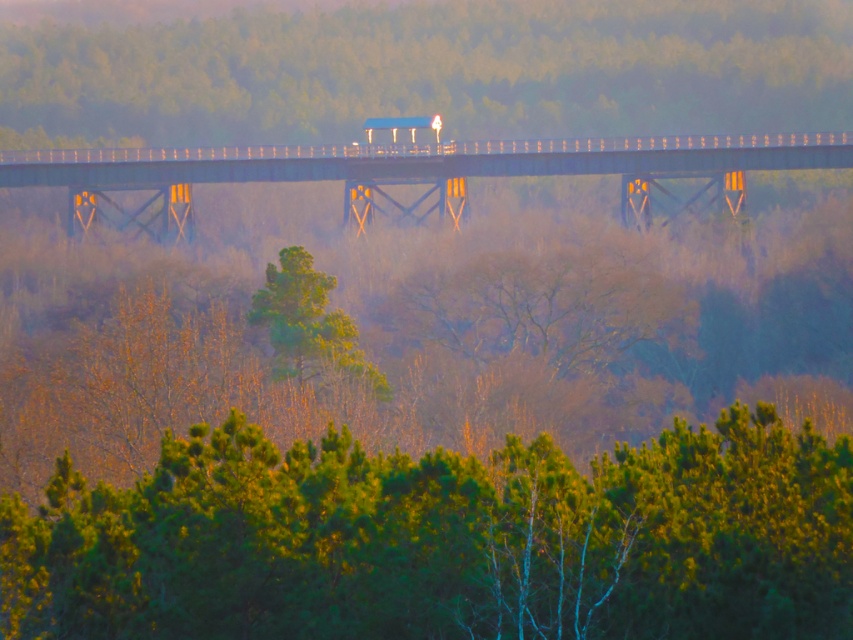
Which is more to the right, green leafy tree at lower center or foggy haze at upper center?

Positioned to the right is green leafy tree at lower center.

Does point (454, 515) come behind point (186, 122)?

No.

Who is more distant from viewer, (808, 552) or (207, 115)?

The point (207, 115) is behind.

The height and width of the screenshot is (640, 853). I want to click on green leafy tree at lower center, so click(x=444, y=540).

Is green leafy tree at lower center closer to camera compared to green matte tree at center?

Yes, it is.

This screenshot has height=640, width=853. Describe the element at coordinates (444, 540) in the screenshot. I see `green leafy tree at lower center` at that location.

Where is `green leafy tree at lower center`? The width and height of the screenshot is (853, 640). green leafy tree at lower center is located at coordinates tap(444, 540).

Does green leafy tree at lower center have a lesser height compared to metal bridge at center?

Yes, green leafy tree at lower center is shorter than metal bridge at center.

Can you confirm if green leafy tree at lower center is smaller than metal bridge at center?

Indeed, green leafy tree at lower center has a smaller size compared to metal bridge at center.

Which is in front, point (500, 595) or point (48, 164)?

Point (500, 595) is in front.

Identify the location of green leafy tree at lower center. (444, 540).